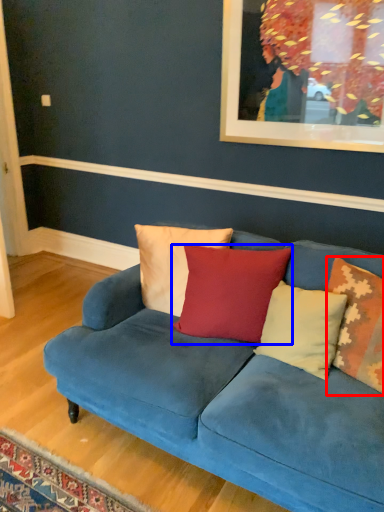
Question: Among these objects, which one is nearest to the camera, pillow (highlighted by a red box) or pillow (highlighted by a blue box)?

Choices:
 (A) pillow
 (B) pillow

Answer: (A)